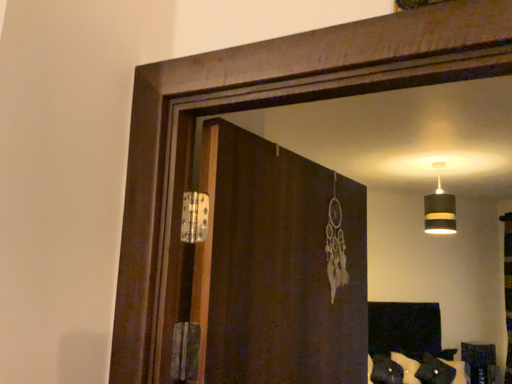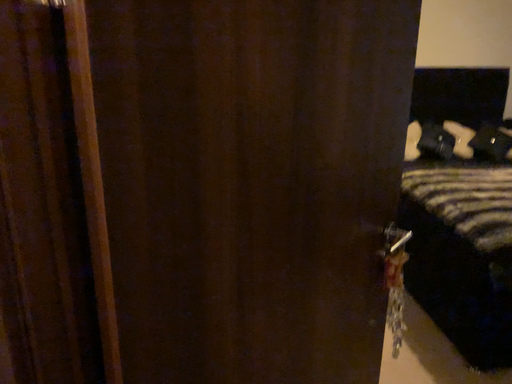
Question: How did the camera likely rotate when shooting the video?

Choices:
 (A) rotated left
 (B) rotated right

Answer: (A)